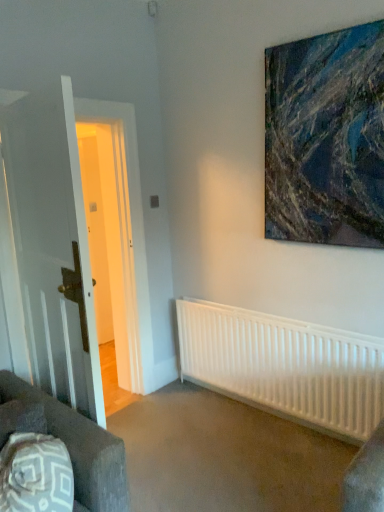
The width and height of the screenshot is (384, 512). Find the location of `abstract painting at upper right`. abstract painting at upper right is located at coordinates (326, 138).

What do you see at coordinates (81, 448) in the screenshot? This screenshot has height=512, width=384. I see `dark brown fabric couch at lower left` at bounding box center [81, 448].

Measure the distance between point [256,313] and camera.

The depth of point [256,313] is 2.90 meters.

From the picture: Measure the distance between white wooden door at left and camera.

The distance of white wooden door at left from camera is 1.71 meters.

What are the coordinates of `abstract painting at upper right` in the screenshot? It's located at pos(326,138).

Is white wooden door at left turned away from abstract painting at upper right?

No, white wooden door at left is not facing away from abstract painting at upper right.

Between white wooden door at left and abstract painting at upper right, which one has more height?

With more height is white wooden door at left.

Is white wooden door at left far from abstract painting at upper right?

Yes, white wooden door at left is far from abstract painting at upper right.

Is white wooden door at left positioned beyond the bounds of abstract painting at upper right?

white wooden door at left is positioned outside abstract painting at upper right.

Which of these two, abstract painting at upper right or white wooden door at left, is smaller?

abstract painting at upper right.

Is abstract painting at upper right looking in the opposite direction of white wooden door at left?

No, abstract painting at upper right is not facing the opposite direction of white wooden door at left.

What's the angular difference between abstract painting at upper right and white wooden door at left's facing directions?

abstract painting at upper right and white wooden door at left are facing 172 degrees away from each other.

Is abstract painting at upper right next to white wooden door at left?

No.

Considering the relative sizes of dark brown fabric couch at lower left and white wooden door at left in the image provided, is dark brown fabric couch at lower left wider than white wooden door at left?

Yes, dark brown fabric couch at lower left is wider than white wooden door at left.

Is dark brown fabric couch at lower left with white wooden door at left?

They are not placed beside each other.

Does dark brown fabric couch at lower left have a lesser height compared to white wooden door at left?

Indeed, dark brown fabric couch at lower left has a lesser height compared to white wooden door at left.

In terms of size, does dark brown fabric couch at lower left appear bigger or smaller than white wooden door at left?

Clearly, dark brown fabric couch at lower left is smaller in size than white wooden door at left.

Do you think white matte radiator at lower center is within abstract painting at upper right, or outside of it?

white matte radiator at lower center is outside abstract painting at upper right.

Locate an element on the screen. This screenshot has height=512, width=384. radiator that is below the abstract painting at upper right (from the image's perspective) is located at coordinates (285, 366).

Is white matte radiator at lower center with abstract painting at upper right?

They are not placed beside each other.

From a real-world perspective, relative to abstract painting at upper right, is white matte radiator at lower center vertically above or below?

Clearly, from a real-world perspective, white matte radiator at lower center is below abstract painting at upper right.

Are white matte radiator at lower center and dark brown fabric couch at lower left beside each other?

No, white matte radiator at lower center is not next to dark brown fabric couch at lower left.

Between white matte radiator at lower center and dark brown fabric couch at lower left, which one has smaller size?

Smaller between the two is dark brown fabric couch at lower left.

From a real-world perspective, is white matte radiator at lower center located higher than dark brown fabric couch at lower left?

No, from a real-world perspective, white matte radiator at lower center is not over dark brown fabric couch at lower left

In the scene shown: Is white wooden door at left looking in the opposite direction of white matte radiator at lower center?

No, white matte radiator at lower center is not at the back of white wooden door at left.

Is white wooden door at left positioned behind white matte radiator at lower center?

That is False.

Identify the location of radiator lying on the right of white wooden door at left. The width and height of the screenshot is (384, 512). (285, 366).

From the picture: Is white wooden door at left directly adjacent to white matte radiator at lower center?

No, white wooden door at left is not making contact with white matte radiator at lower center.

This screenshot has width=384, height=512. In order to click on glass door above the dark brown fabric couch at lower left (from a real-world perspective) in this screenshot , I will do `click(53, 247)`.

Considering the sizes of objects white wooden door at left and dark brown fabric couch at lower left in the image provided, who is wider, white wooden door at left or dark brown fabric couch at lower left?

dark brown fabric couch at lower left is wider.

Is white wooden door at left situated inside dark brown fabric couch at lower left or outside?

The correct answer is: outside.

The width and height of the screenshot is (384, 512). What are the coordinates of `picture frame that is above the white wooden door at left (from the image's perspective)` in the screenshot? It's located at (326, 138).

Where is `picture frame on the right of white wooden door at left`? The height and width of the screenshot is (512, 384). picture frame on the right of white wooden door at left is located at coordinates (326, 138).

When comparing their distances from white matte radiator at lower center, does abstract painting at upper right or white wooden door at left seem further?

Among the two, white wooden door at left is located further to white matte radiator at lower center.

Based on their spatial positions, is abstract painting at upper right or white matte radiator at lower center further from dark brown fabric couch at lower left?

Based on the image, abstract painting at upper right appears to be further to dark brown fabric couch at lower left.

When comparing their distances from white wooden door at left, does dark brown fabric couch at lower left or abstract painting at upper right seem further?

abstract painting at upper right is further to white wooden door at left.

From the image, which object appears to be nearer to dark brown fabric couch at lower left, white matte radiator at lower center or abstract painting at upper right?

white matte radiator at lower center is closer to dark brown fabric couch at lower left.

Which object lies further to the anchor point abstract painting at upper right, white wooden door at left or white matte radiator at lower center?

Among the two, white wooden door at left is located further to abstract painting at upper right.

Considering their positions, is dark brown fabric couch at lower left positioned closer to white wooden door at left than white matte radiator at lower center?

dark brown fabric couch at lower left.

Estimate the real-world distances between objects in this image. Which object is further from white matte radiator at lower center, dark brown fabric couch at lower left or abstract painting at upper right?

dark brown fabric couch at lower left.

Estimate the real-world distances between objects in this image. Which object is further from abstract painting at upper right, dark brown fabric couch at lower left or white matte radiator at lower center?

Based on the image, dark brown fabric couch at lower left appears to be further to abstract painting at upper right.

The image size is (384, 512). I want to click on studio couch between white wooden door at left and abstract painting at upper right, so click(81, 448).

You are a GUI agent. You are given a task and a screenshot of the screen. Output one action in this format:
    pyautogui.click(x=<x>, y=<y>)
    Task: Click on the radiator between white wooden door at left and abstract painting at upper right in the horizontal direction
    
    Given the screenshot: What is the action you would take?
    pyautogui.click(x=285, y=366)

Where is `radiator between abstract painting at upper right and dark brown fabric couch at lower left from top to bottom`? The width and height of the screenshot is (384, 512). radiator between abstract painting at upper right and dark brown fabric couch at lower left from top to bottom is located at coordinates (285, 366).

Where is `studio couch between white wooden door at left and white matte radiator at lower center`? The image size is (384, 512). studio couch between white wooden door at left and white matte radiator at lower center is located at coordinates (81, 448).